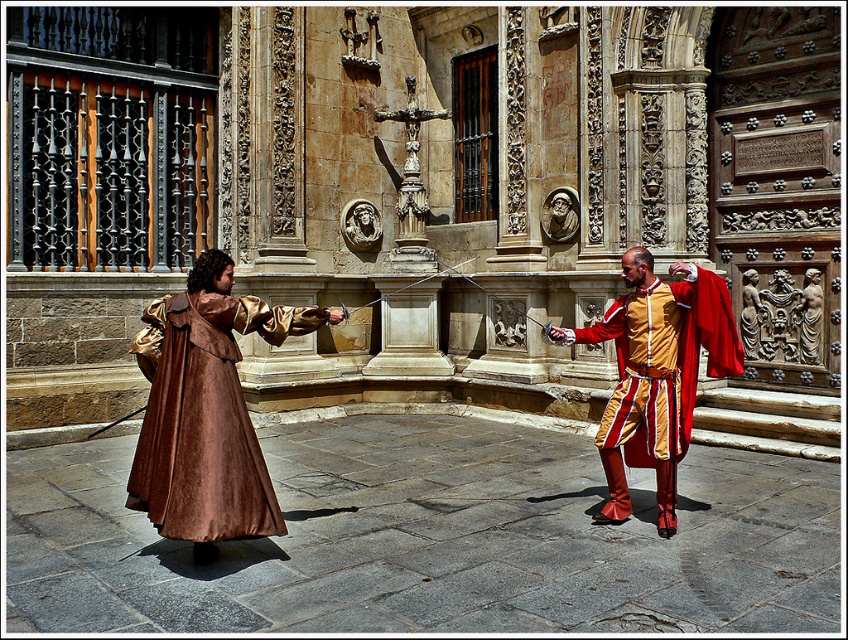
Who is more forward, (230, 456) or (672, 410)?

Point (230, 456)

Which is in front, point (192, 509) or point (668, 289)?

Point (192, 509) is more forward.

This screenshot has height=640, width=848. I want to click on brown suede cloak at center, so click(x=205, y=419).